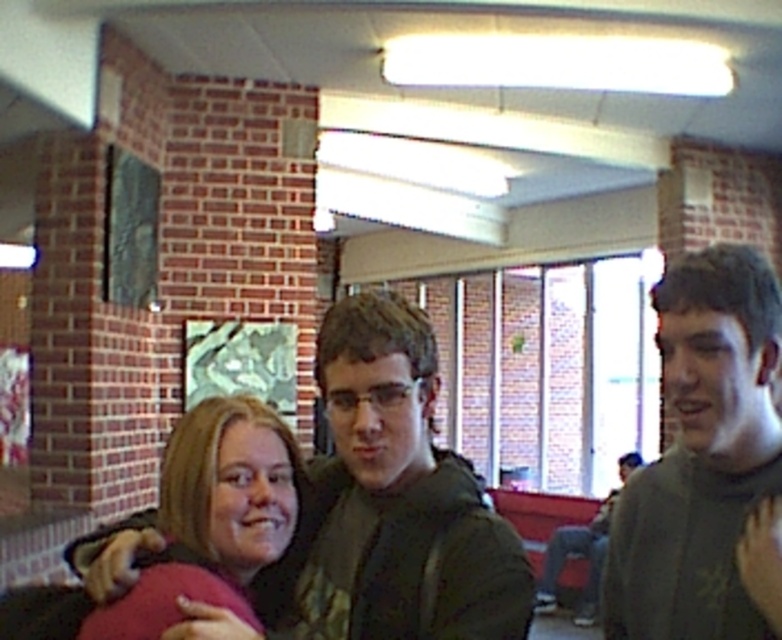
Is blonde hair at center bigger than dark gray jacket at right?

No.

Who is more distant from viewer, [212,440] or [597,516]?

Positioned behind is point [597,516].

At what (x,y) coordinates should I click in order to perform the action: click on blonde hair at center. Please return your answer as a coordinate pair (x, y). Looking at the image, I should click on (196, 474).

I want to click on blonde hair at center, so click(196, 474).

Does matte green sweater at center have a lesser width compared to blonde hair at center?

No.

Based on the photo, who is shorter, matte green sweater at center or blonde hair at center?

With less height is blonde hair at center.

Which is behind, point (317, 362) or point (92, 552)?

Positioned behind is point (92, 552).

Identify the location of matte green sweater at center. The height and width of the screenshot is (640, 782). (396, 499).

Does point (124, 564) come behind point (583, 534)?

No, (124, 564) is closer to viewer.

Does matte green sweater at center appear on the left side of dark gray jacket at right?

Indeed, matte green sweater at center is positioned on the left side of dark gray jacket at right.

Is point (526, 595) farther from camera compared to point (555, 580)?

No.

Image resolution: width=782 pixels, height=640 pixels. Find the location of `matte green sweater at center`. matte green sweater at center is located at coordinates (396, 499).